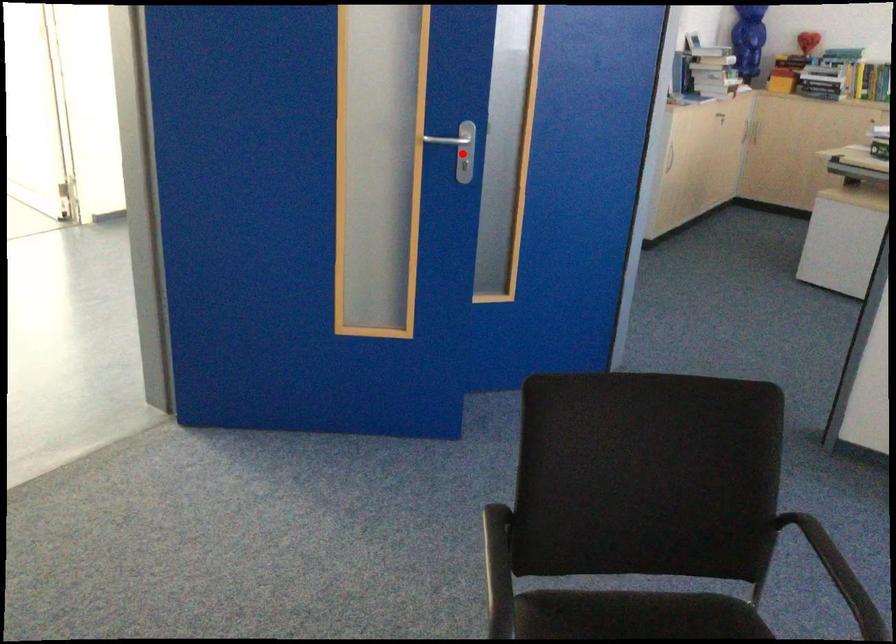
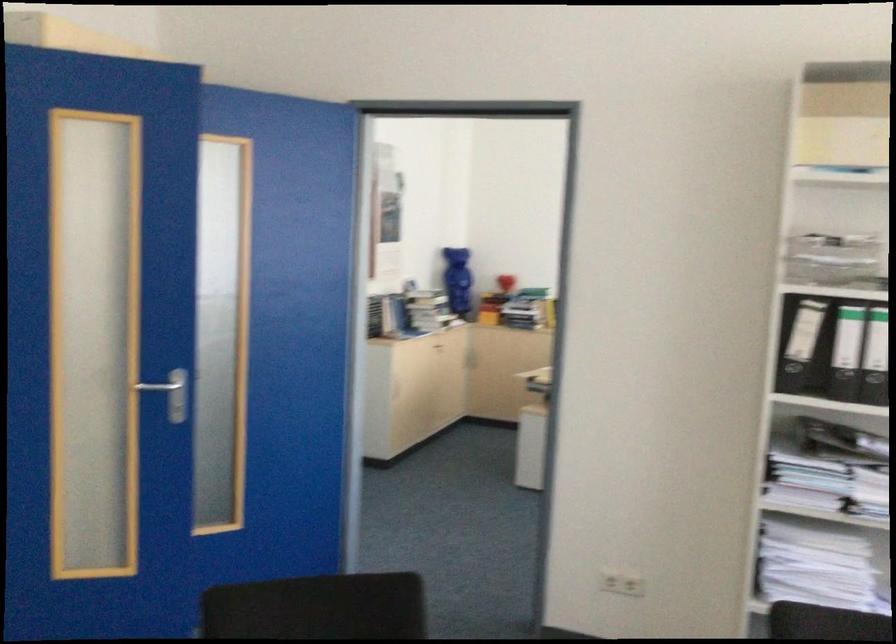
Find the pixel in the second image that matches the highlighted location in the first image.

(176, 398)